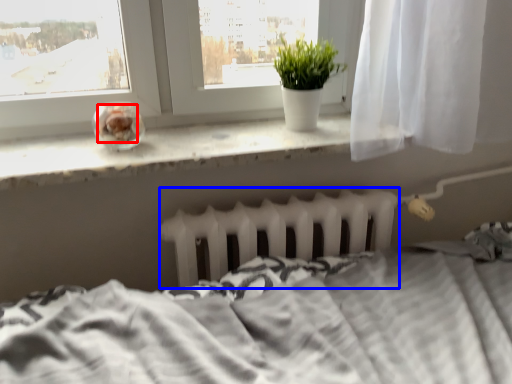
Question: Which of the following is the farthest to the observer, food (highlighted by a red box) or radiator (highlighted by a blue box)?

Choices:
 (A) food
 (B) radiator

Answer: (B)